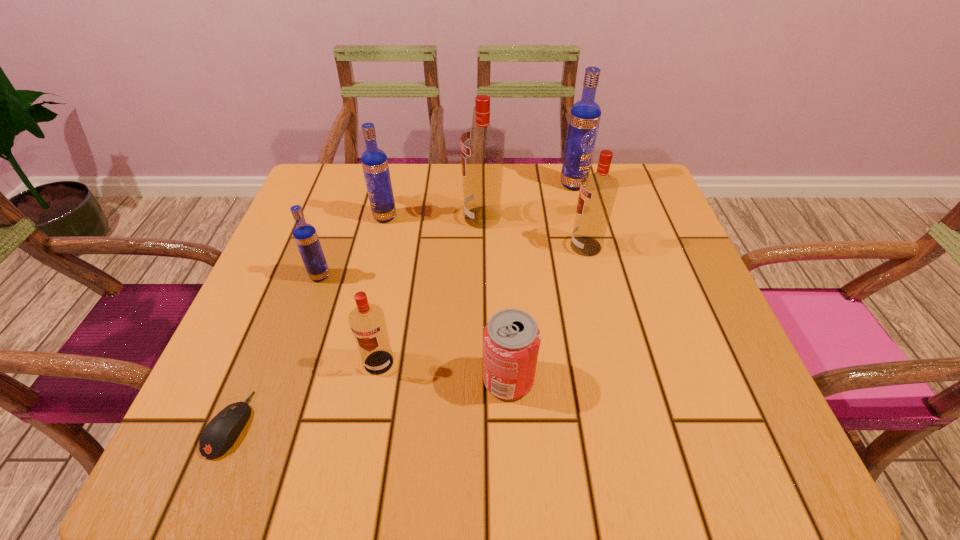
You are a GUI agent. You are given a task and a screenshot of the screen. Output one action in this format:
    pyautogui.click(x=<x>, y=<y>)
    Task: Click on the object present at the near left corner
    The width and height of the screenshot is (960, 540).
    Given the screenshot: What is the action you would take?
    pyautogui.click(x=219, y=435)

In order to click on free spot at the far edge of the desktop in this screenshot , I will do `click(514, 173)`.

In order to click on vacant space at the near edge of the desktop in this screenshot , I will do click(407, 467).

Image resolution: width=960 pixels, height=540 pixels. In the image, there is a desktop. Identify the location of vacant space at the left edge. (328, 225).

Image resolution: width=960 pixels, height=540 pixels. In the image, there is a desktop. Identify the location of free region at the right edge. (616, 248).

Identify the location of vacant space at the far left corner of the desktop. This screenshot has width=960, height=540. (357, 202).

Locate an element on the screen. The height and width of the screenshot is (540, 960). free space at the far right corner of the desktop is located at coordinates pos(648,207).

Find the location of a particular element. Image resolution: width=960 pixels, height=540 pixels. vacant region at the near right corner of the desktop is located at coordinates (708, 444).

Locate an element on the screen. The height and width of the screenshot is (540, 960). unoccupied area between the seventh tallest object and the leftmost vodka is located at coordinates (414, 328).

Locate an element on the screen. vacant area that lies between the fourth vodka from left to right and the fifth farthest vodka is located at coordinates click(x=401, y=247).